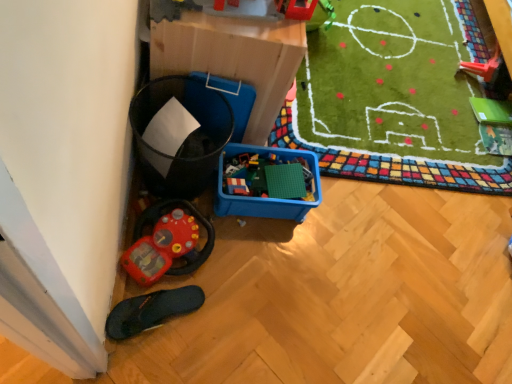
Question: From a real-world perspective, is blue plastic storage box at lower left positioned above or below rubberized red toy car at lower left, the first toy from the left?

Choices:
 (A) below
 (B) above

Answer: (B)

Question: Is blue plastic storage box at lower left spatially inside rubberized red toy car at lower left, the first toy from the left, or outside of it?

Choices:
 (A) outside
 (B) inside

Answer: (A)

Question: Which object is positioned farthest from the black rubber slipper at lower left?

Choices:
 (A) rubberized plastic toy at upper right, acting as the third toy starting from the bottom
 (B) rubberized red toy car at lower left, the first toy from the left
 (C) blue plastic storage box at lower left
 (D) rubberized plastic toy at upper center, the second toy from the left

Answer: (A)

Question: Considering the real-world distances, which object is closest to the rubberized plastic toy at upper center, which is the 2th toy in top-to-bottom order?

Choices:
 (A) black rubber slipper at lower left
 (B) rubberized red toy car at lower left, which appears as the first toy when ordered from the bottom
 (C) rubberized plastic toy at upper right, acting as the 1th toy starting from the top
 (D) blue plastic storage box at lower left

Answer: (D)